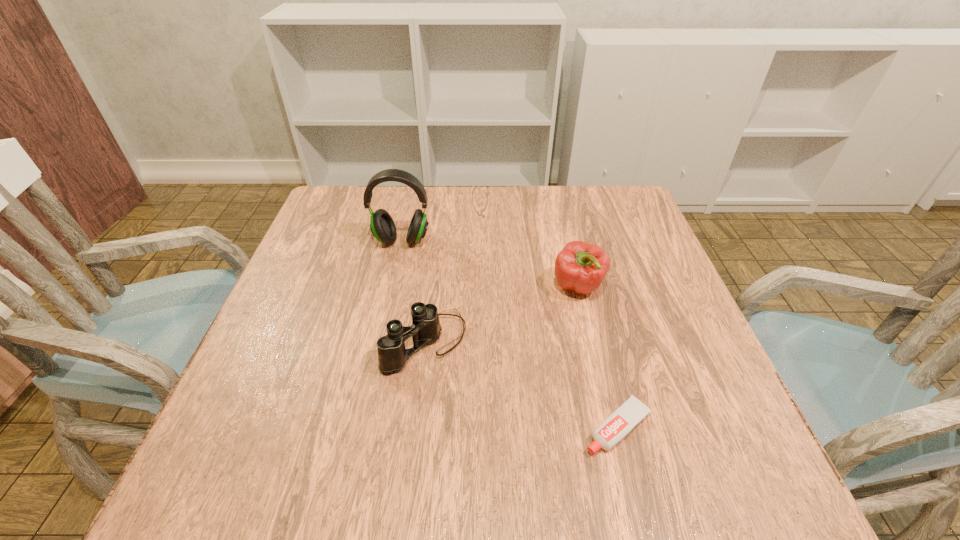
Where is `free space at the right edge of the desktop`? free space at the right edge of the desktop is located at coordinates (617, 285).

The image size is (960, 540). I want to click on vacant area at the far left corner, so click(357, 224).

Where is `free space at the far right corner of the desktop`? This screenshot has width=960, height=540. free space at the far right corner of the desktop is located at coordinates (593, 212).

Locate an element on the screen. free spot between the tallest object and the binoculars is located at coordinates (414, 291).

The height and width of the screenshot is (540, 960). Identify the location of empty location between the bell pepper and the nearest object. (598, 357).

The width and height of the screenshot is (960, 540). What are the coordinates of `free area in between the second tallest object and the tallest object` in the screenshot? It's located at (490, 264).

Image resolution: width=960 pixels, height=540 pixels. In order to click on free space between the toothpaste and the tallest object in this screenshot , I will do point(510,334).

Find the location of `empty location between the second nearest object and the second tallest object`. empty location between the second nearest object and the second tallest object is located at coordinates (502, 314).

Locate an element on the screen. The image size is (960, 540). free area in between the headset and the third tallest object is located at coordinates tap(414, 291).

You are a GUI agent. You are given a task and a screenshot of the screen. Output one action in this format:
    pyautogui.click(x=<x>, y=<y>)
    Task: Click on the vacant area between the tallest object and the binoculars
    The height and width of the screenshot is (540, 960).
    Given the screenshot: What is the action you would take?
    pyautogui.click(x=414, y=291)